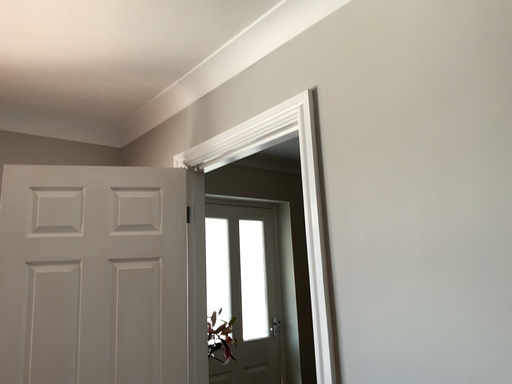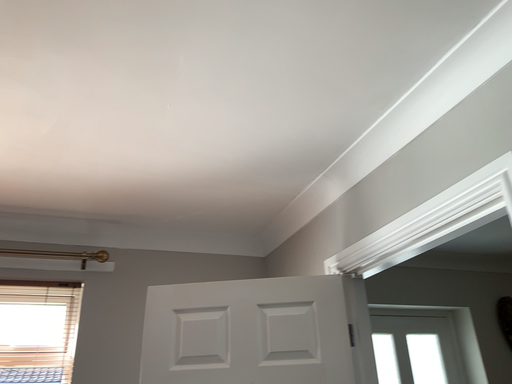
Question: Which way did the camera rotate in the video?

Choices:
 (A) rotated downward
 (B) rotated upward

Answer: (B)